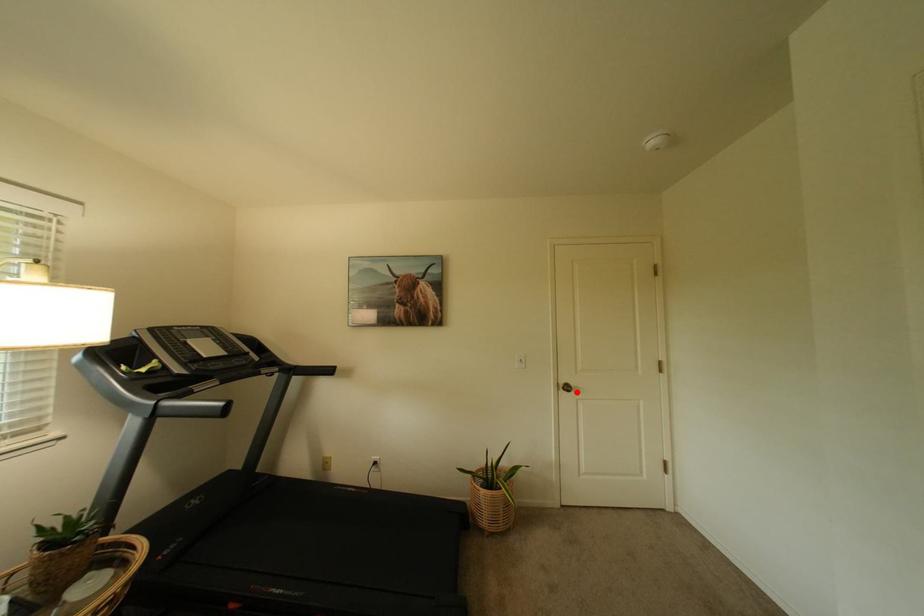
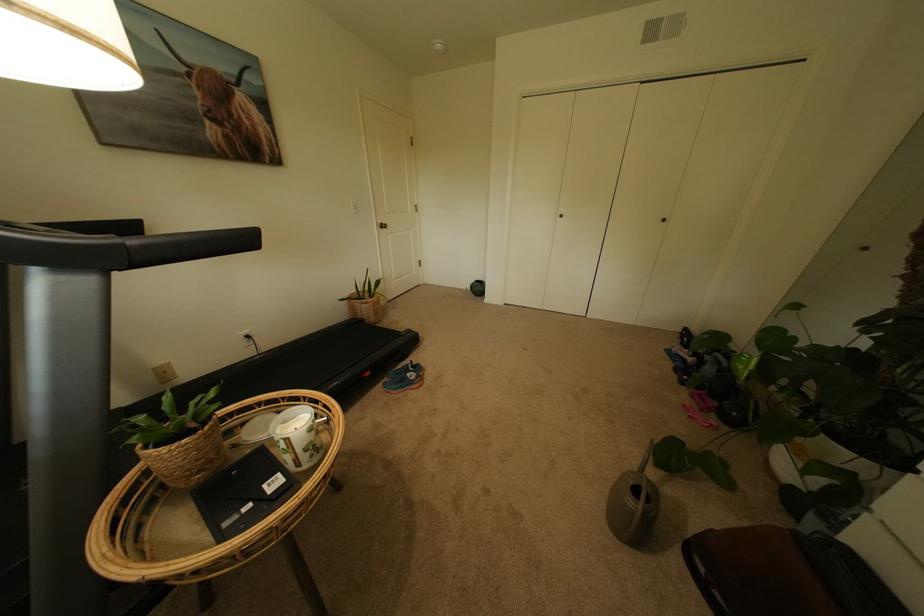
Question: I am providing you with two images of the same scene from different viewpoints. Image1 has a red point marked. In image2, the corresponding 3D location appears at what relative position? Reply with the corresponding letter.

Choices:
 (A) Closer
 (B) Farther

Answer: (A)